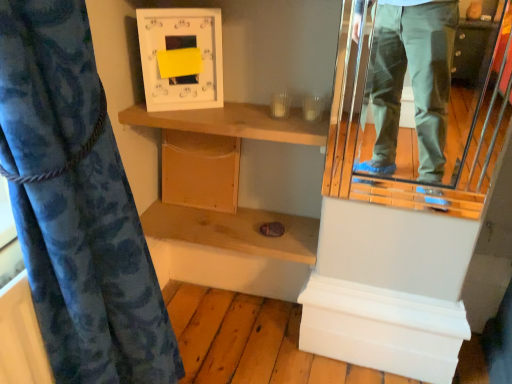
Question: Could metallic reflective mirror at right be considered to be inside blue floral fabric at left?

Choices:
 (A) no
 (B) yes

Answer: (A)

Question: From a real-world perspective, does blue floral fabric at left stand above metallic reflective mirror at right?

Choices:
 (A) no
 (B) yes

Answer: (A)

Question: From the image's perspective, is blue floral fabric at left on top of metallic reflective mirror at right?

Choices:
 (A) no
 (B) yes

Answer: (A)

Question: From a real-world perspective, is blue floral fabric at left physically below metallic reflective mirror at right?

Choices:
 (A) no
 (B) yes

Answer: (B)

Question: Is blue floral fabric at left not close to metallic reflective mirror at right?

Choices:
 (A) yes
 (B) no

Answer: (A)

Question: From a real-world perspective, is wooden shelf at center, acting as the second shelf starting from the top, above or below blue floral fabric at left?

Choices:
 (A) below
 (B) above

Answer: (A)

Question: Is wooden shelf at center, placed as the first shelf when sorted from bottom to top, taller or shorter than blue floral fabric at left?

Choices:
 (A) short
 (B) tall

Answer: (A)

Question: Is wooden shelf at center, placed as the first shelf when sorted from bottom to top, inside or outside of blue floral fabric at left?

Choices:
 (A) inside
 (B) outside

Answer: (B)

Question: From the image's perspective, is wooden shelf at center, acting as the second shelf starting from the top, above or below blue floral fabric at left?

Choices:
 (A) above
 (B) below

Answer: (A)

Question: In the image, is wooden shelf at upper center, acting as the 2th shelf starting from the bottom, positioned in front of or behind wooden cabinet at center?

Choices:
 (A) front
 (B) behind

Answer: (A)

Question: Considering the positions of wooden shelf at upper center, acting as the 2th shelf starting from the bottom, and wooden cabinet at center in the image, is wooden shelf at upper center, acting as the 2th shelf starting from the bottom, bigger or smaller than wooden cabinet at center?

Choices:
 (A) small
 (B) big

Answer: (B)

Question: Visually, is wooden shelf at upper center, positioned as the first shelf in top-to-bottom order, positioned to the left or to the right of wooden cabinet at center?

Choices:
 (A) left
 (B) right

Answer: (B)

Question: Considering the positions of wooden shelf at upper center, positioned as the first shelf in top-to-bottom order, and wooden cabinet at center in the image, is wooden shelf at upper center, positioned as the first shelf in top-to-bottom order, taller or shorter than wooden cabinet at center?

Choices:
 (A) short
 (B) tall

Answer: (A)

Question: Based on their sizes in the image, would you say wooden shelf at upper center, acting as the 2th shelf starting from the bottom, is bigger or smaller than blue floral fabric at left?

Choices:
 (A) big
 (B) small

Answer: (B)

Question: From their relative heights in the image, would you say wooden shelf at upper center, positioned as the first shelf in top-to-bottom order, is taller or shorter than blue floral fabric at left?

Choices:
 (A) short
 (B) tall

Answer: (A)